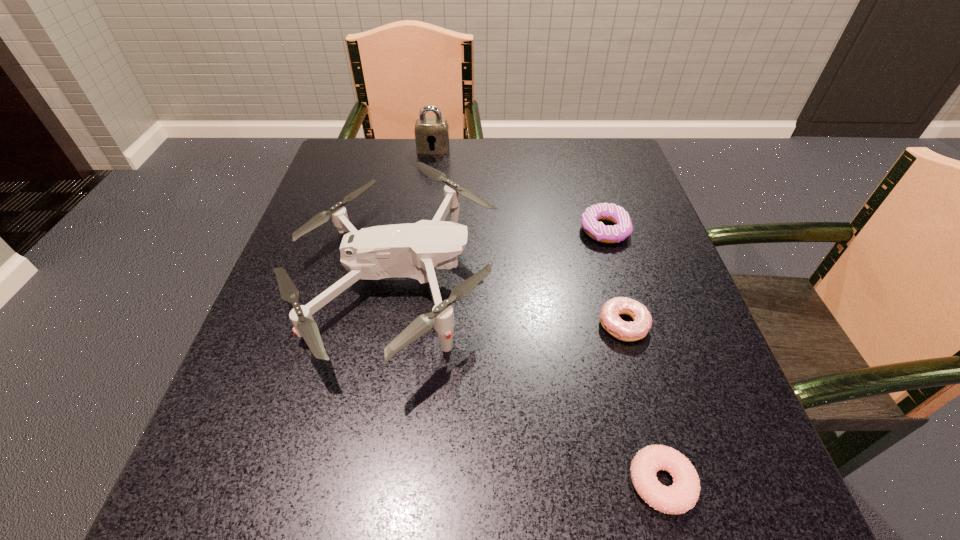
Find the location of `blank region between the farthest doughnut and the nearest object`. blank region between the farthest doughnut and the nearest object is located at coordinates tap(633, 356).

At what (x,y) coordinates should I click in order to perform the action: click on vacant point located between the second nearest doughnut and the drone. Please return your answer as a coordinate pair (x, y). Looking at the image, I should click on (509, 304).

Identify the location of the third closest object to the padlock. The width and height of the screenshot is (960, 540). (610, 320).

In order to click on the second closest object to the nearest object in this screenshot , I will do `click(413, 250)`.

Identify which doughnut is located as the nearest to the third shortest object. Please provide its 2D coordinates. Your answer should be formatted as a tuple, i.e. [(x, y)], where the tuple contains the x and y coordinates of a point satisfying the conditions above.

[(610, 320)]

Find the location of a particular element. The height and width of the screenshot is (540, 960). doughnut that stands as the second closest to the third tallest object is located at coordinates (682, 495).

Identify the location of vacant region that satisfies the following two spatial constraints: 1. at the front of the padlock near the keyhole; 2. on the left side of the nearest doughnut. (386, 483).

You are a GUI agent. You are given a task and a screenshot of the screen. Output one action in this format:
    pyautogui.click(x=<x>, y=<y>)
    Task: Click on the vacant space that satisfies the following two spatial constraints: 1. on the back side of the second nearest doughnut; 2. on the right side of the nearest object
    The height and width of the screenshot is (540, 960).
    Given the screenshot: What is the action you would take?
    pyautogui.click(x=618, y=325)

I want to click on vacant region that satisfies the following two spatial constraints: 1. on the front side of the tallest doughnut; 2. with a camera at the front of the drone, so click(620, 283).

What are the coordinates of `free space in the image that satisfies the following two spatial constraints: 1. with a camera at the front of the nearest doughnut; 2. on the right side of the drone` in the screenshot? It's located at (356, 483).